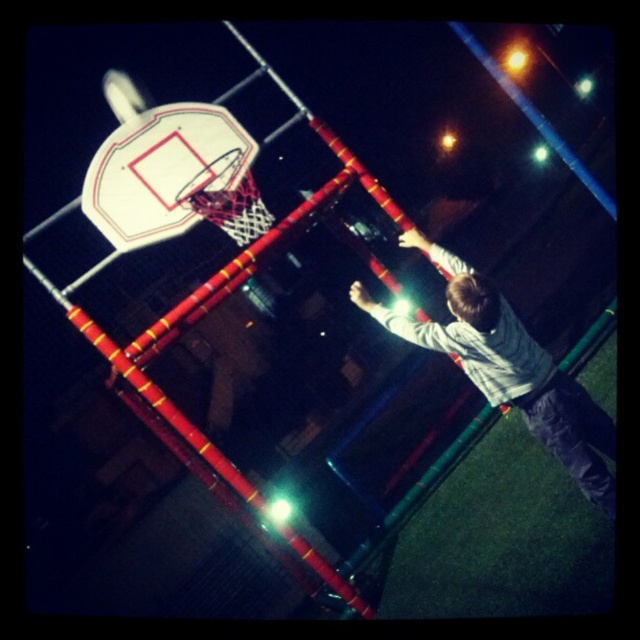
Question: Which of the following is the farthest from the observer?

Choices:
 (A) (147, 132)
 (B) (396, 323)

Answer: (A)

Question: Is light gray sweater at center above white glossy basketball hoop at upper center?

Choices:
 (A) no
 (B) yes

Answer: (A)

Question: Which of the following is the farthest from the observer?

Choices:
 (A) (598, 476)
 (B) (92, 163)

Answer: (B)

Question: Does light gray sweater at center come in front of white glossy basketball hoop at upper center?

Choices:
 (A) no
 (B) yes

Answer: (B)

Question: Is light gray sweater at center to the left of white glossy basketball hoop at upper center from the viewer's perspective?

Choices:
 (A) yes
 (B) no

Answer: (B)

Question: Which point appears farthest from the camera in this image?

Choices:
 (A) (522, 365)
 (B) (156, 141)

Answer: (B)